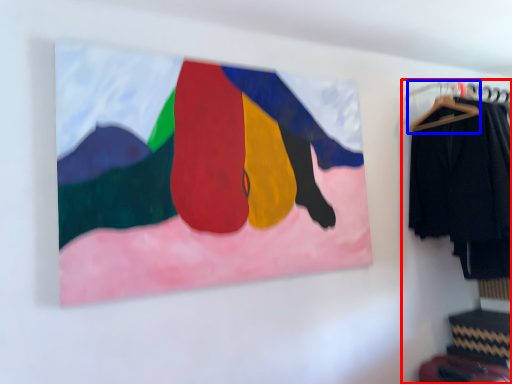
Question: Which object appears closest to the camera in this image, closet (highlighted by a red box) or hanger (highlighted by a blue box)?

Choices:
 (A) closet
 (B) hanger

Answer: (A)